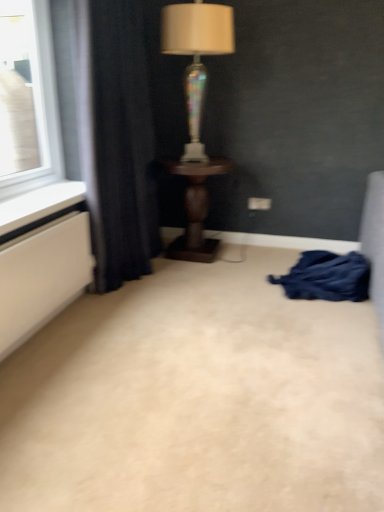
Question: Is iridescent glass lamp at center positioned behind dark blue fabric at lower right?

Choices:
 (A) no
 (B) yes

Answer: (B)

Question: Is the position of iridescent glass lamp at center less distant than that of dark blue fabric at lower right?

Choices:
 (A) no
 (B) yes

Answer: (A)

Question: Can dark blue fabric at lower right be found inside iridescent glass lamp at center?

Choices:
 (A) no
 (B) yes

Answer: (A)

Question: Is iridescent glass lamp at center shorter than dark blue fabric at lower right?

Choices:
 (A) no
 (B) yes

Answer: (A)

Question: From a real-world perspective, is iridescent glass lamp at center physically below dark blue fabric at lower right?

Choices:
 (A) yes
 (B) no

Answer: (B)

Question: Would you say iridescent glass lamp at center is a long distance from dark blue fabric at lower right?

Choices:
 (A) yes
 (B) no

Answer: (A)

Question: Is beige carpet at center not inside dark wood table at center?

Choices:
 (A) yes
 (B) no

Answer: (A)

Question: Is beige carpet at center taller than dark wood table at center?

Choices:
 (A) yes
 (B) no

Answer: (B)

Question: Is the depth of beige carpet at center less than that of dark wood table at center?

Choices:
 (A) no
 (B) yes

Answer: (B)

Question: Is beige carpet at center smaller than dark wood table at center?

Choices:
 (A) yes
 (B) no

Answer: (A)

Question: Can you confirm if beige carpet at center is bigger than dark wood table at center?

Choices:
 (A) no
 (B) yes

Answer: (A)

Question: Can you confirm if beige carpet at center is shorter than dark wood table at center?

Choices:
 (A) yes
 (B) no

Answer: (A)

Question: Is dark blue fabric at left far from dark blue fabric at lower right?

Choices:
 (A) no
 (B) yes

Answer: (B)